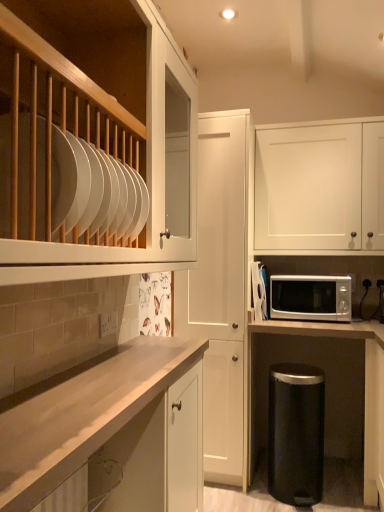
Image resolution: width=384 pixels, height=512 pixels. Find the location of `light wood countertop at center, the third cabinetry in the right-to-left sequence`. light wood countertop at center, the third cabinetry in the right-to-left sequence is located at coordinates (83, 415).

Where is `white matte cabinet at center, which is counted as the 2th cabinetry, starting from the left`? white matte cabinet at center, which is counted as the 2th cabinetry, starting from the left is located at coordinates (221, 292).

Consider the image. Measure the distance between black matte trash can at lower right and camera.

6.92 feet.

What do you see at coordinates (296, 433) in the screenshot?
I see `black matte trash can at lower right` at bounding box center [296, 433].

This screenshot has width=384, height=512. I want to click on silver metallic microwave at lower right, so click(x=310, y=298).

Image resolution: width=384 pixels, height=512 pixels. What are the coordinates of `white matte cabinet at upper right, the third cabinetry in the front-to-back sequence` in the screenshot? It's located at (320, 187).

Describe the element at coordinates (320, 187) in the screenshot. The image size is (384, 512). I see `white matte cabinet at upper right, acting as the 1th cabinetry starting from the right` at that location.

I want to click on light wood countertop at center, marked as the 3th cabinetry in a back-to-front arrangement, so click(x=83, y=415).

Is white matte cabinet at upper right, the third cabinetry in the front-to-back sequence, in contact with white matte cabinet at center, the second cabinetry when ordered from front to back?

No, white matte cabinet at upper right, the third cabinetry in the front-to-back sequence, is not touching white matte cabinet at center, the second cabinetry when ordered from front to back.

From a real-world perspective, relative to white matte cabinet at center, arranged as the second cabinetry when viewed from the back, is white matte cabinet at upper right, the first cabinetry positioned from the back, vertically above or below?

From a real-world perspective, white matte cabinet at upper right, the first cabinetry positioned from the back, is physically above white matte cabinet at center, arranged as the second cabinetry when viewed from the back.

Between white matte cabinet at upper right, acting as the 3th cabinetry starting from the left, and white matte cabinet at center, which is counted as the 2th cabinetry, starting from the left, which one has larger size?

white matte cabinet at center, which is counted as the 2th cabinetry, starting from the left.

Identify the location of cabinetry on the right of the white matte cabinet at center, which is counted as the 2th cabinetry, starting from the left. This screenshot has height=512, width=384. (320, 187).

Considering the relative sizes of black matte trash can at lower right and silver metallic microwave at lower right in the image provided, is black matte trash can at lower right thinner than silver metallic microwave at lower right?

Correct, the width of black matte trash can at lower right is less than that of silver metallic microwave at lower right.

From the image's perspective, relative to silver metallic microwave at lower right, is black matte trash can at lower right above or below?

black matte trash can at lower right is below silver metallic microwave at lower right.

Which object is positioned more to the right, black matte trash can at lower right or silver metallic microwave at lower right?

Positioned to the right is silver metallic microwave at lower right.

Is white glossy microwave at center facing towards light wood countertop at center, marked as the 3th cabinetry in a back-to-front arrangement?

No, white glossy microwave at center is not facing towards light wood countertop at center, marked as the 3th cabinetry in a back-to-front arrangement.

Looking at this image, would you say white glossy microwave at center is to the left or to the right of light wood countertop at center, marked as the first cabinetry in a front-to-back arrangement, in the picture?

In the image, white glossy microwave at center appears on the right side of light wood countertop at center, marked as the first cabinetry in a front-to-back arrangement.

Is white glossy microwave at center inside the boundaries of light wood countertop at center, positioned as the 1th cabinetry in left-to-right order, or outside?

white glossy microwave at center cannot be found inside light wood countertop at center, positioned as the 1th cabinetry in left-to-right order.

Measure the distance from black matte trash can at lower right to light wood countertop at center, marked as the first cabinetry in a front-to-back arrangement.

black matte trash can at lower right is 1.03 meters away from light wood countertop at center, marked as the first cabinetry in a front-to-back arrangement.

Looking at the image, does black matte trash can at lower right seem bigger or smaller compared to light wood countertop at center, marked as the first cabinetry in a front-to-back arrangement?

Considering their sizes, black matte trash can at lower right takes up less space than light wood countertop at center, marked as the first cabinetry in a front-to-back arrangement.

From the image's perspective, is black matte trash can at lower right above or below light wood countertop at center, marked as the 3th cabinetry in a back-to-front arrangement?

Based on their image positions, black matte trash can at lower right is located beneath light wood countertop at center, marked as the 3th cabinetry in a back-to-front arrangement.

How many degrees apart are the facing directions of black matte trash can at lower right and light wood countertop at center, marked as the first cabinetry in a front-to-back arrangement?

88.6 degrees separate the facing orientations of black matte trash can at lower right and light wood countertop at center, marked as the first cabinetry in a front-to-back arrangement.

From the picture: From a real-world perspective, which is physically above, white matte cabinet at center, the second cabinetry when ordered from front to back, or silver metallic microwave at lower right?

white matte cabinet at center, the second cabinetry when ordered from front to back, is physically above.

Considering the points (226, 192) and (313, 302), which point is in front, point (226, 192) or point (313, 302)?

The point (226, 192) is closer.

Which object is thinner, white matte cabinet at center, arranged as the second cabinetry when viewed from the back, or silver metallic microwave at lower right?

Thinner between the two is silver metallic microwave at lower right.

What's the angular difference between white matte cabinet at center, arranged as the second cabinetry when viewed from the back, and silver metallic microwave at lower right's facing directions?

There is a 1.98-degree angle between the facing directions of white matte cabinet at center, arranged as the second cabinetry when viewed from the back, and silver metallic microwave at lower right.

Who is shorter, white glossy microwave at center or white matte cabinet at upper right, acting as the 3th cabinetry starting from the left?

white glossy microwave at center is shorter.

Does white glossy microwave at center have a lesser width compared to white matte cabinet at upper right, the first cabinetry positioned from the back?

No.

In the image, there is a white matte cabinet at upper right, acting as the 3th cabinetry starting from the left. At what (x,y) coordinates should I click in order to perform the action: click on countertop below it (from a real-world perspective). Please return your answer as a coordinate pair (x, y). Looking at the image, I should click on pyautogui.click(x=319, y=329).

Are white glossy microwave at center and white matte cabinet at upper right, acting as the 1th cabinetry starting from the right, far apart?

white glossy microwave at center is near white matte cabinet at upper right, acting as the 1th cabinetry starting from the right, not far away.

Does point (311, 416) appear closer or farther from the camera than point (358, 330)?

Point (311, 416) appears to be closer to the viewer than point (358, 330).

Is black matte trash can at lower right oriented away from white glossy microwave at center?

black matte trash can at lower right is not turned away from white glossy microwave at center.

From the image's perspective, between black matte trash can at lower right and white glossy microwave at center, who is located below?

black matte trash can at lower right.

From a real-world perspective, is black matte trash can at lower right physically above white glossy microwave at center?

Actually, black matte trash can at lower right is physically below white glossy microwave at center in the real world.

From the image's perspective, starting from the white matte cabinet at upper right, the first cabinetry positioned from the back, which cabinetry is the 1st one below? Please provide its 2D coordinates.

[(221, 292)]

Where is `microwave oven behind the black matte trash can at lower right`? The height and width of the screenshot is (512, 384). microwave oven behind the black matte trash can at lower right is located at coordinates (310, 298).

Which object lies nearer to the anchor point light wood countertop at center, the third cabinetry in the right-to-left sequence, white glossy microwave at center or white matte cabinet at upper right, the first cabinetry positioned from the back?

white glossy microwave at center.

When comparing their distances from white matte cabinet at center, which is the 2th cabinetry from right to left, does black matte trash can at lower right or white matte cabinet at upper right, the third cabinetry in the front-to-back sequence, seem closer?

black matte trash can at lower right is positioned closer to the anchor white matte cabinet at center, which is the 2th cabinetry from right to left.

Which object lies nearer to the anchor point white matte cabinet at upper right, the third cabinetry in the front-to-back sequence, silver metallic microwave at lower right or light wood countertop at center, the third cabinetry in the right-to-left sequence?

The object closer to white matte cabinet at upper right, the third cabinetry in the front-to-back sequence, is silver metallic microwave at lower right.

Estimate the real-world distances between objects in this image. Which object is closer to white glossy microwave at center, silver metallic microwave at lower right or white matte cabinet at upper right, the third cabinetry in the front-to-back sequence?

silver metallic microwave at lower right is closer to white glossy microwave at center.

Estimate the real-world distances between objects in this image. Which object is further from white matte cabinet at upper right, the third cabinetry in the front-to-back sequence, white glossy microwave at center or white matte cabinet at center, the second cabinetry when ordered from front to back?

white glossy microwave at center is positioned further to the anchor white matte cabinet at upper right, the third cabinetry in the front-to-back sequence.

Which object lies further to the anchor point white matte cabinet at upper right, acting as the 3th cabinetry starting from the left, white glossy microwave at center or black matte trash can at lower right?

Based on the image, black matte trash can at lower right appears to be further to white matte cabinet at upper right, acting as the 3th cabinetry starting from the left.

Based on their spatial positions, is black matte trash can at lower right or light wood countertop at center, positioned as the 1th cabinetry in left-to-right order, closer to white matte cabinet at center, arranged as the second cabinetry when viewed from the back?

The object closer to white matte cabinet at center, arranged as the second cabinetry when viewed from the back, is black matte trash can at lower right.

Which object lies nearer to the anchor point black matte trash can at lower right, white glossy microwave at center or white matte cabinet at upper right, acting as the 3th cabinetry starting from the left?

white glossy microwave at center lies closer to black matte trash can at lower right than the other object.

The image size is (384, 512). In order to click on countertop that lies between silver metallic microwave at lower right and black matte trash can at lower right from top to bottom in this screenshot , I will do `click(319, 329)`.

You are a GUI agent. You are given a task and a screenshot of the screen. Output one action in this format:
    pyautogui.click(x=<x>, y=<y>)
    Task: Click on the countertop between light wood countertop at center, positioned as the 1th cabinetry in left-to-right order, and silver metallic microwave at lower right, along the z-axis
    This screenshot has height=512, width=384.
    Given the screenshot: What is the action you would take?
    pyautogui.click(x=319, y=329)

Image resolution: width=384 pixels, height=512 pixels. What are the coordinates of `countertop located between white matte cabinet at center, arranged as the second cabinetry when viewed from the back, and silver metallic microwave at lower right in the left-right direction` in the screenshot? It's located at (319, 329).

Where is `cabinetry between white matte cabinet at upper right, acting as the 3th cabinetry starting from the left, and silver metallic microwave at lower right, in the vertical direction`? The height and width of the screenshot is (512, 384). cabinetry between white matte cabinet at upper right, acting as the 3th cabinetry starting from the left, and silver metallic microwave at lower right, in the vertical direction is located at coordinates coord(221,292).